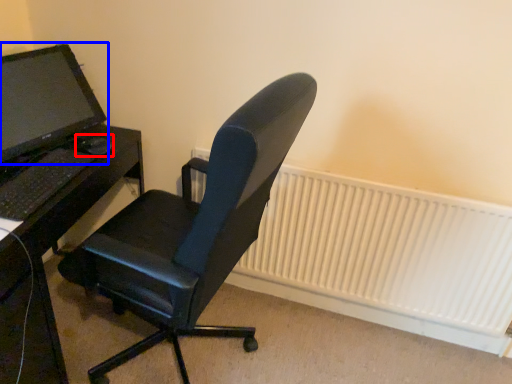
Question: Which of the following is the farthest to the observer, mouse (highlighted by a red box) or computer monitor (highlighted by a blue box)?

Choices:
 (A) mouse
 (B) computer monitor

Answer: (A)